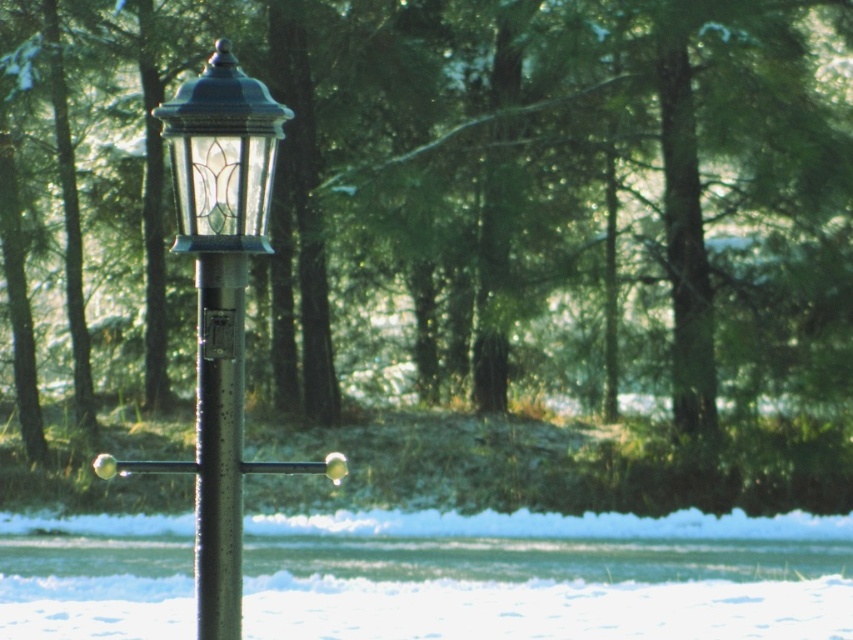
You are an artist planning to paint the winter scene. You want to ensure the proportions between the glossy metal street light at center and the matte glass lantern at center are accurate. Which object should you depict as taller?

The glossy metal street light at center should be depicted as taller since it has a greater height compared to the matte glass lantern at center.

You are standing in front of the vintage street lamp and want to touch the matte glass lantern at center and the metallic pole at center. Which object will you reach first?

The matte glass lantern at center is closer to the viewer than the metallic pole at center, so you will reach the matte glass lantern at center first.

In the winter scene, there is a glossy metal street light at center. What is located at the coordinates point (221, 301)?

The glossy metal street light at center is located at point (221, 301).